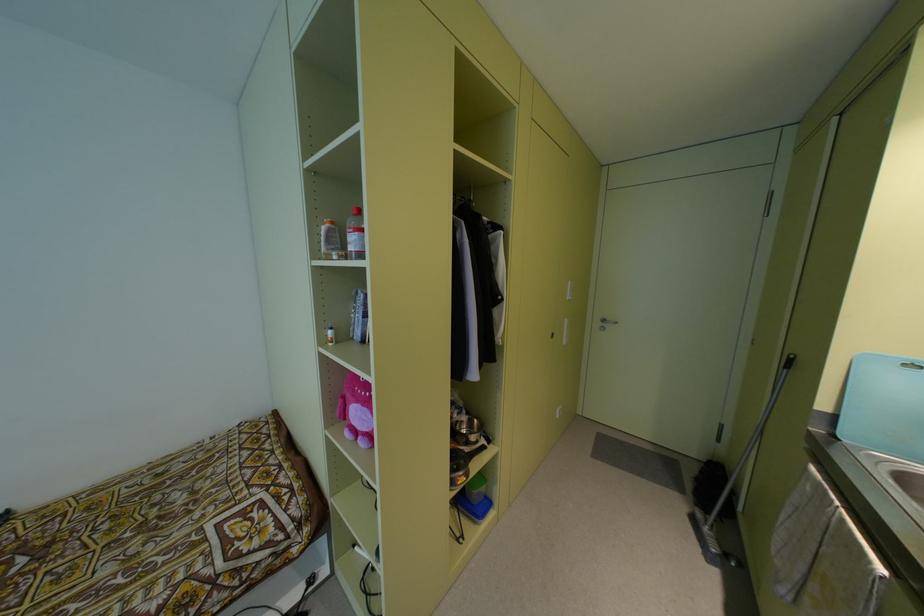
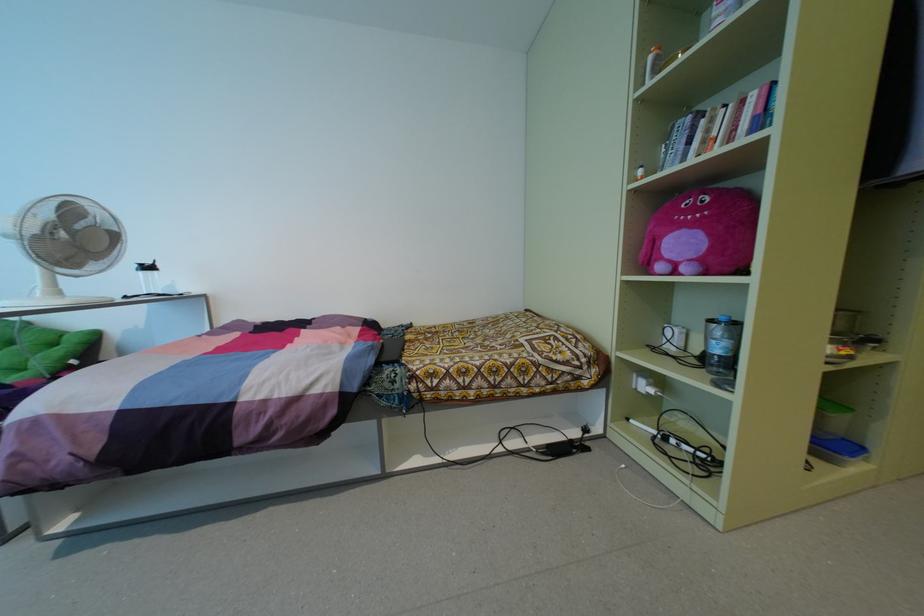
Where in the second image is the point corresponding to (322,228) from the first image?

(650, 57)